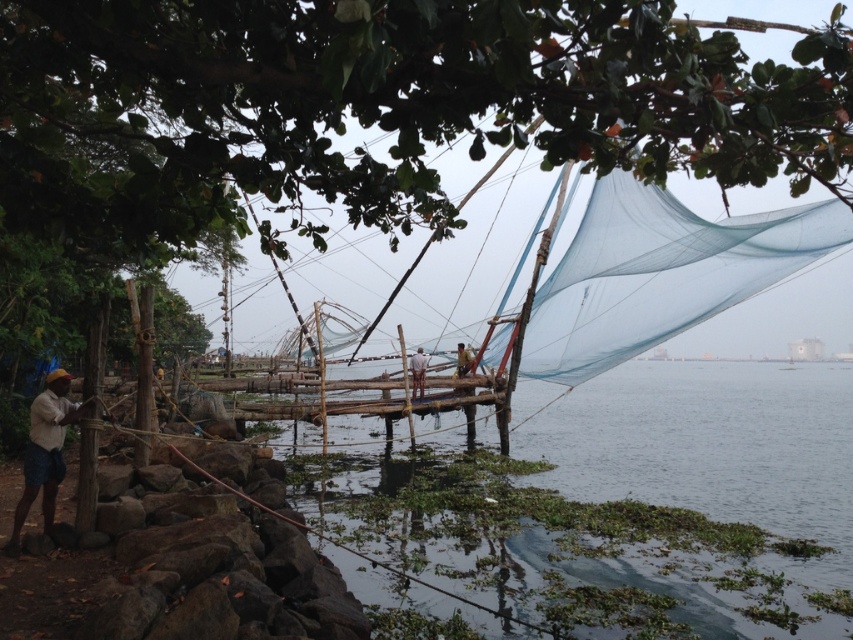
You are a hiker who wants to take a photo of the green leafy tree at upper center. You are currently standing at the point marked by the coordinates point (x=383, y=104). Is the green leafy tree at upper center directly in front of you, or do you need to move left or right to see it better?

The point (x=383, y=104) marks the green leafy tree at upper center, so you are already standing at the location of the tree. To take a photo, you might need to move back to capture it fully or adjust your angle for a better view.

Based on the scene description, where is the clear water at center located in the image?

The clear water at center is located at point [618,493] in the image.

You are standing at the location of the matte yellow cap at lower left and want to throw a stone into the clear water at center. Based on the distance provided, can you estimate whether the throw is possible with a typical human arm strength?

The clear water at center is 13.58 meters away from the matte yellow cap at lower left. A typical human can throw a stone about 10 to 15 meters, so it is possible but requires a strong throw.